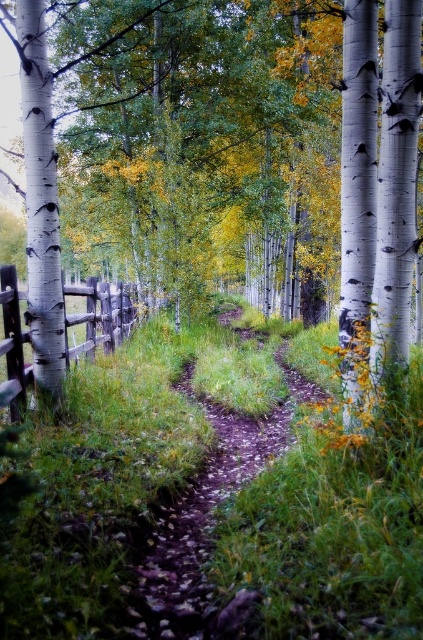
Question: Is white smooth tree at center closer to camera compared to brown wooden fence at left?

Choices:
 (A) no
 (B) yes

Answer: (B)

Question: Does white smooth tree at center lie behind brown wooden fence at left?

Choices:
 (A) yes
 (B) no

Answer: (B)

Question: Which object is positioned farthest from the white smooth tree at center?

Choices:
 (A) brown wooden fence at left
 (B) brown dirt path at center

Answer: (B)

Question: Which object is closer to the camera taking this photo?

Choices:
 (A) brown wooden fence at left
 (B) brown dirt path at center
 (C) white smooth tree at center

Answer: (C)

Question: Is white smooth tree at center positioned before brown wooden fence at left?

Choices:
 (A) no
 (B) yes

Answer: (B)

Question: Which object appears closest to the camera in this image?

Choices:
 (A) brown wooden fence at left
 (B) brown dirt path at center

Answer: (A)